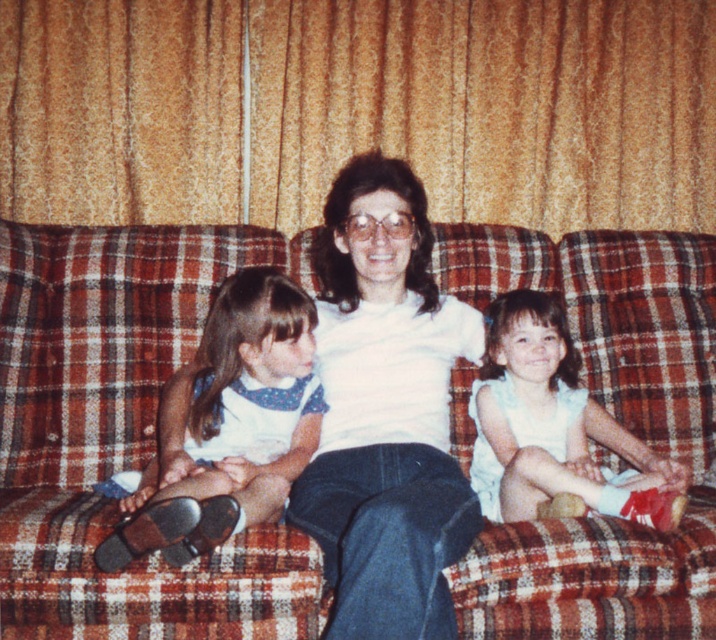
Does plaid fabric couch at center appear on the left side of brown leather shoes at lower left?

Incorrect, plaid fabric couch at center is not on the left side of brown leather shoes at lower left.

Is point (91, 618) positioned behind point (246, 476)?

No, it is not.

Who is more forward, (19,416) or (238,346)?

Point (238,346) is more forward.

Identify the location of plaid fabric couch at center. 120,433.

Can you confirm if plaid fabric couch at center is bigger than white satin dress at center?

Yes, plaid fabric couch at center is bigger than white satin dress at center.

Does point (684, 244) come closer to viewer compared to point (546, 388)?

No, (684, 244) is further to viewer.

Find the location of `plaid fabric couch at center`. plaid fabric couch at center is located at coordinates (120, 433).

This screenshot has height=640, width=716. I want to click on plaid fabric couch at center, so click(x=120, y=433).

Between point (412, 589) and point (304, 353), which one is positioned behind?

Point (304, 353)

Where is `white matte shirt at center`? white matte shirt at center is located at coordinates pyautogui.click(x=384, y=412).